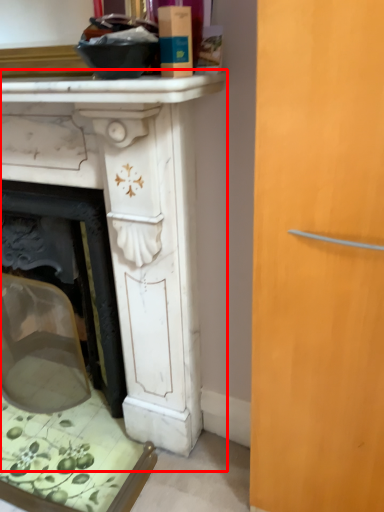
Question: Where is table (annotated by the red box) located in relation to counter top in the image?

Choices:
 (A) right
 (B) left

Answer: (B)